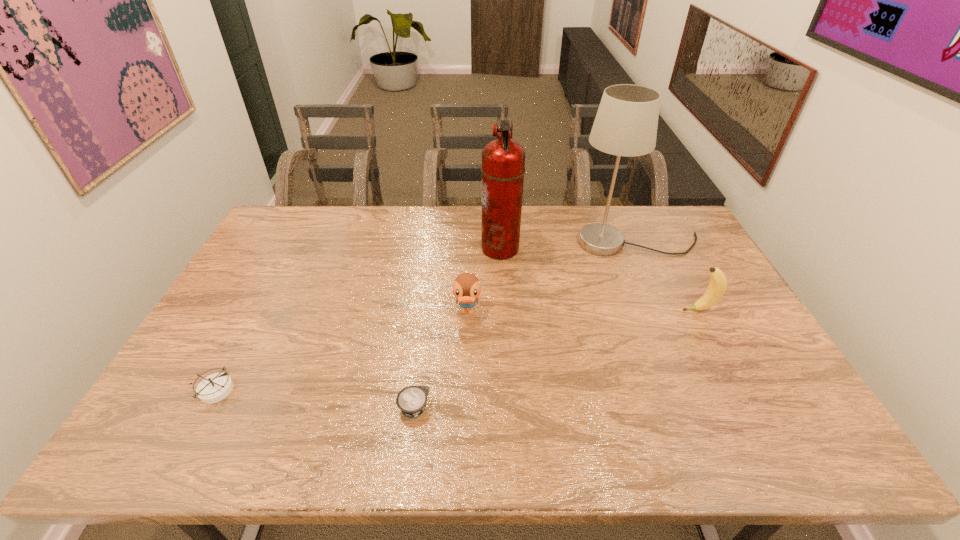
Image resolution: width=960 pixels, height=540 pixels. In the image, there is a desktop. Find the location of `vacant space at the far right corner`. vacant space at the far right corner is located at coordinates (688, 234).

Locate an element on the screen. This screenshot has width=960, height=540. vacant space at the near right corner of the desktop is located at coordinates (763, 455).

The image size is (960, 540). I want to click on vacant area that lies between the table lamp and the fire extinguisher, so click(x=568, y=246).

Identify the location of free space between the third tallest object and the third shortest object. This screenshot has width=960, height=540. (583, 311).

Locate an element on the screen. empty space between the second shortest object and the table lamp is located at coordinates (426, 317).

At what (x,y) coordinates should I click in order to perform the action: click on free space that is in between the table lamp and the third tallest object. Please return your answer as a coordinate pair (x, y). This screenshot has width=960, height=540. Looking at the image, I should click on [667, 276].

At what (x,y) coordinates should I click in order to perform the action: click on free space between the fire extinguisher and the fourth object from right to left. Please return your answer as a coordinate pair (x, y). Looking at the image, I should click on (484, 280).

Where is `empty location between the duck and the shortest object`? The height and width of the screenshot is (540, 960). empty location between the duck and the shortest object is located at coordinates (441, 360).

Identify the location of free space between the third object from right to left and the yogurt. The width and height of the screenshot is (960, 540). (457, 328).

I want to click on blank region between the duck and the banana, so click(x=583, y=311).